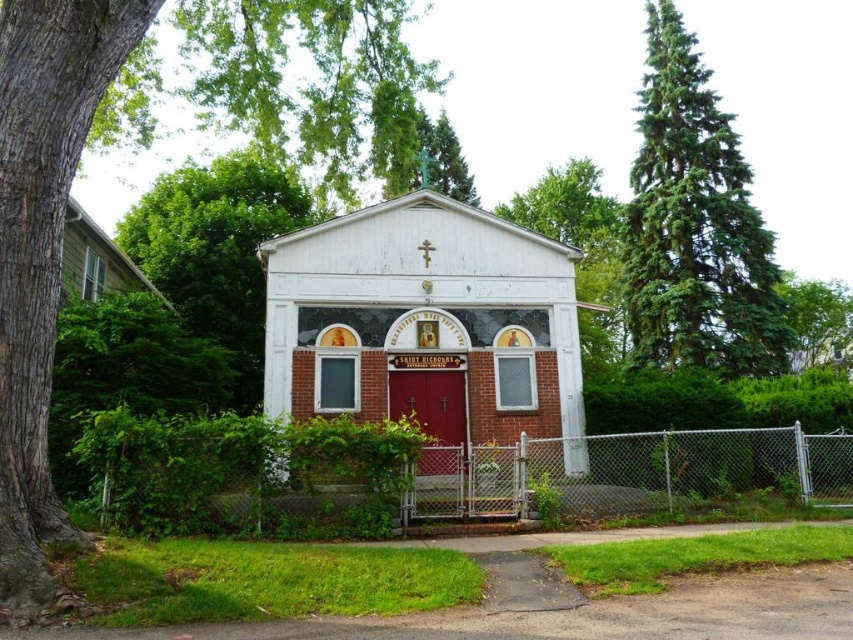
Is point (587, 275) positioned before point (813, 346)?

Yes, it is in front of point (813, 346).

This screenshot has width=853, height=640. I want to click on green leafy tree at upper center, so click(581, 250).

The height and width of the screenshot is (640, 853). Find the location of `green leafy tree at upper center`. green leafy tree at upper center is located at coordinates (581, 250).

Does point (363, 305) come closer to viewer compared to point (593, 168)?

Yes, it is in front of point (593, 168).

Based on the photo, who is taller, white painted wood chapel at center or green leafy tree at upper center?

green leafy tree at upper center

Between point (380, 378) and point (567, 196), which one is positioned behind?

The point (567, 196) is more distant.

You are a GUI agent. You are given a task and a screenshot of the screen. Output one action in this format:
    pyautogui.click(x=<x>, y=<y>)
    Task: Click on the white painted wood chapel at center
    
    Given the screenshot: What is the action you would take?
    pyautogui.click(x=427, y=326)

Measure the distance between point (283,388) and camera.

Point (283,388) and camera are 11.79 meters apart from each other.

Which is more to the left, white painted wood chapel at center or green leafy tree at upper left?

green leafy tree at upper left

Is point (454, 403) positioned before point (263, 189)?

That is True.

Identify the location of white painted wood chapel at center. (427, 326).